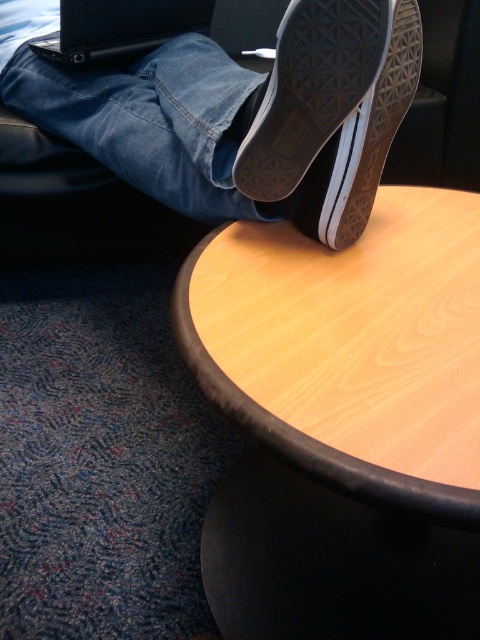
Question: Which object appears farthest from the camera in this image?

Choices:
 (A) wooden table at upper center
 (B) black matte laptop at upper left

Answer: (B)

Question: Does black canvas shoe at upper center have a larger size compared to black matte laptop at upper left?

Choices:
 (A) no
 (B) yes

Answer: (A)

Question: Among these points, which one is nearest to the camera?

Choices:
 (A) (314, 113)
 (B) (347, 196)
 (C) (137, 12)
 (D) (404, 113)

Answer: (A)

Question: Can you confirm if black canvas shoe at upper center is positioned above black rubber shoe at upper center?

Choices:
 (A) yes
 (B) no

Answer: (A)

Question: Can you confirm if white canvas shoe at upper center is positioned to the left of black matte laptop at upper left?

Choices:
 (A) yes
 (B) no

Answer: (B)

Question: Which object is the farthest from the black matte laptop at upper left?

Choices:
 (A) black canvas shoe at upper center
 (B) wooden table at upper center

Answer: (B)